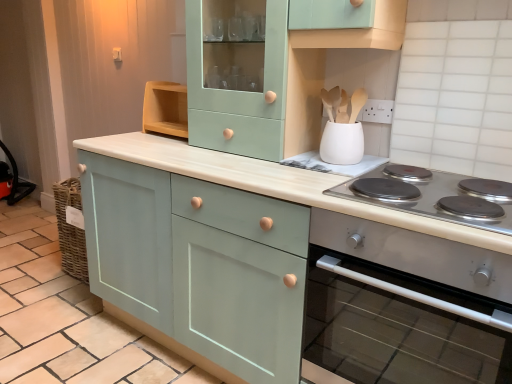
Where is `blank space above matte green cabinet at center, acting as the 1th cabinetry starting from the right (from a real-world perspective)`? The width and height of the screenshot is (512, 384). blank space above matte green cabinet at center, acting as the 1th cabinetry starting from the right (from a real-world perspective) is located at coordinates (282, 166).